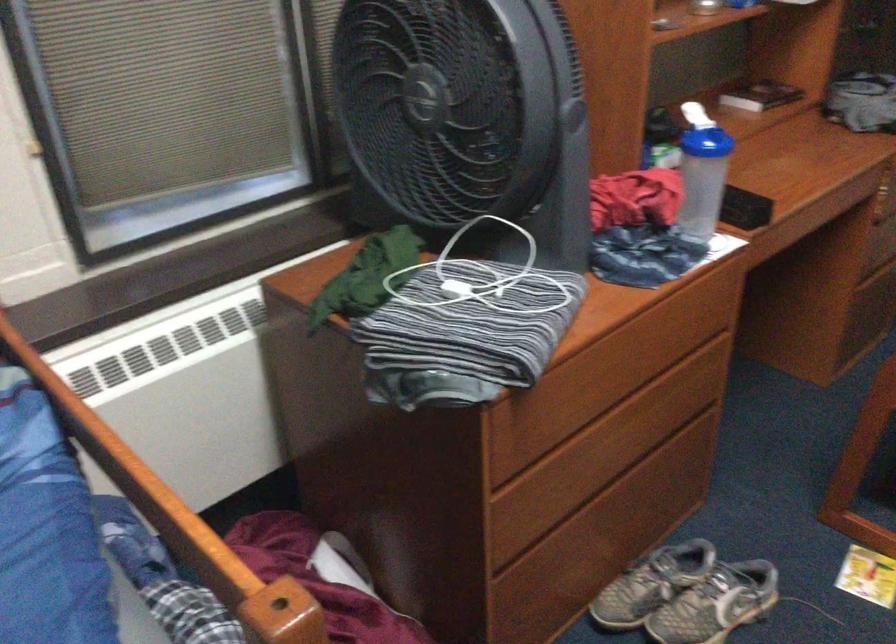
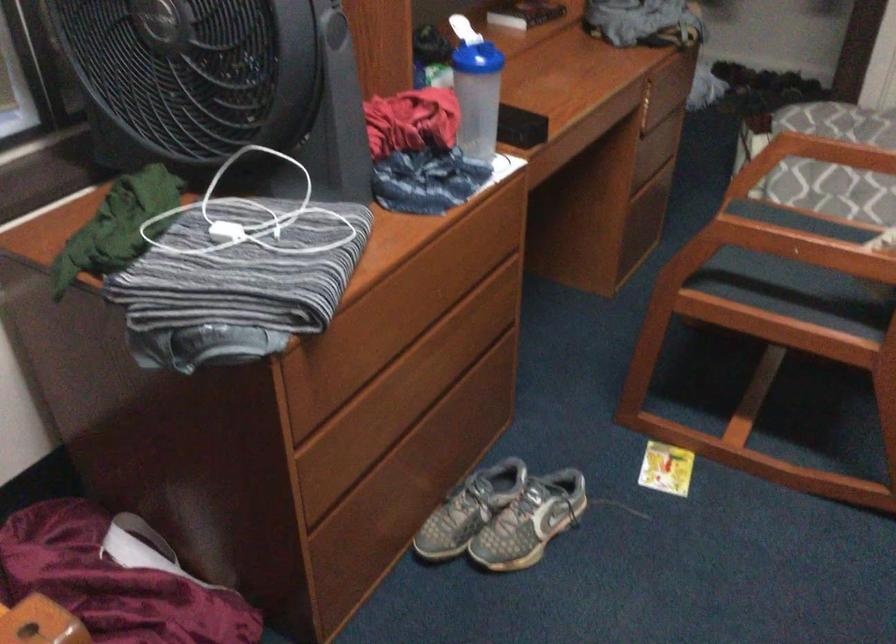
The point at (701,180) is marked in the first image. Where is the corresponding point in the second image?

(478, 97)